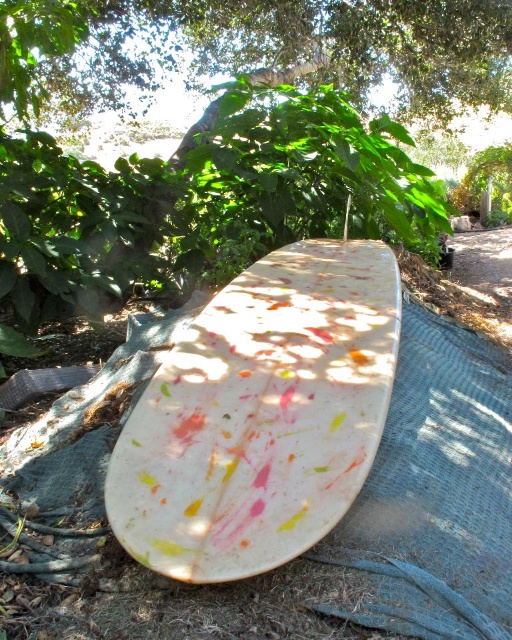
Does painted wood surfboard at center come in front of green leafy tree at center?

Yes.

From the picture: Who is more distant from viewer, [348,426] or [47,109]?

Positioned behind is point [47,109].

At what (x,y) coordinates should I click in order to perform the action: click on painted wood surfboard at center. Please return your answer as a coordinate pair (x, y). The height and width of the screenshot is (640, 512). Looking at the image, I should click on (261, 416).